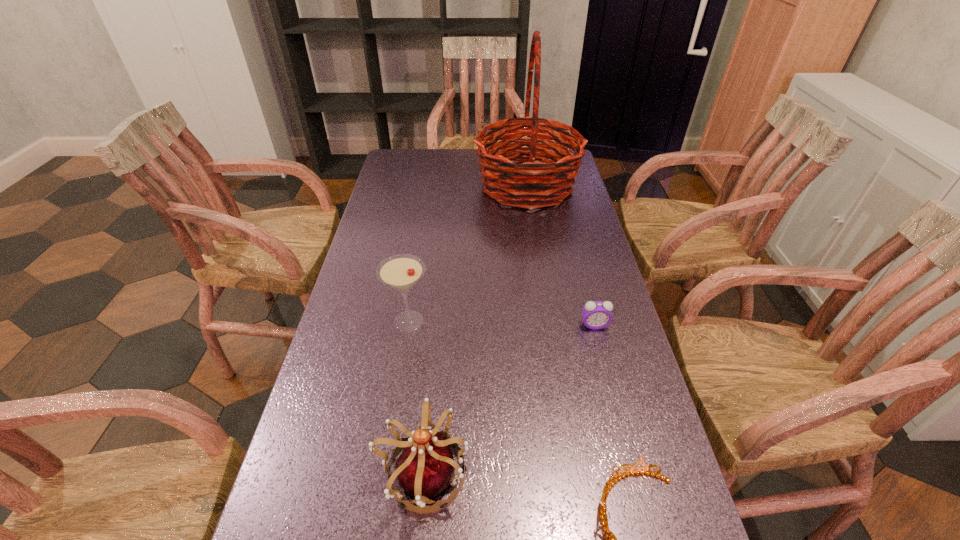
In order to click on unoccupied area between the martini and the left tiara in this screenshot , I will do `click(416, 398)`.

Identify the location of free spot between the basket and the taller tiara. (475, 330).

The image size is (960, 540). I want to click on free spot between the martini and the left tiara, so click(416, 398).

Where is `free space between the alarm clock and the basket`? The width and height of the screenshot is (960, 540). free space between the alarm clock and the basket is located at coordinates (561, 256).

What are the coordinates of `free space between the taller tiara and the farthest object` in the screenshot? It's located at (475, 330).

This screenshot has height=540, width=960. What are the coordinates of `empty location between the alarm clock and the farthest object` in the screenshot? It's located at (561, 256).

Point out which object is positioned as the third nearest to the shorter tiara. Please provide its 2D coordinates. Your answer should be formatted as a tuple, i.e. [(x, y)], where the tuple contains the x and y coordinates of a point satisfying the conditions above.

[(402, 271)]

Find the location of a particular element. object that ranks as the closest to the alarm clock is located at coordinates (619, 475).

At what (x,y) coordinates should I click in order to perform the action: click on blank space that satisfies the following two spatial constraints: 1. on the front side of the farthest object; 2. on the front-facing side of the taller tiara. Please return your answer as a coordinate pair (x, y). Looking at the image, I should click on (571, 474).

At what (x,y) coordinates should I click in order to perform the action: click on free spot that satisfies the following two spatial constraints: 1. on the front side of the tallest object; 2. on the front-facing side of the taller tiara. Please return your answer as a coordinate pair (x, y). The image size is (960, 540). Looking at the image, I should click on (571, 474).